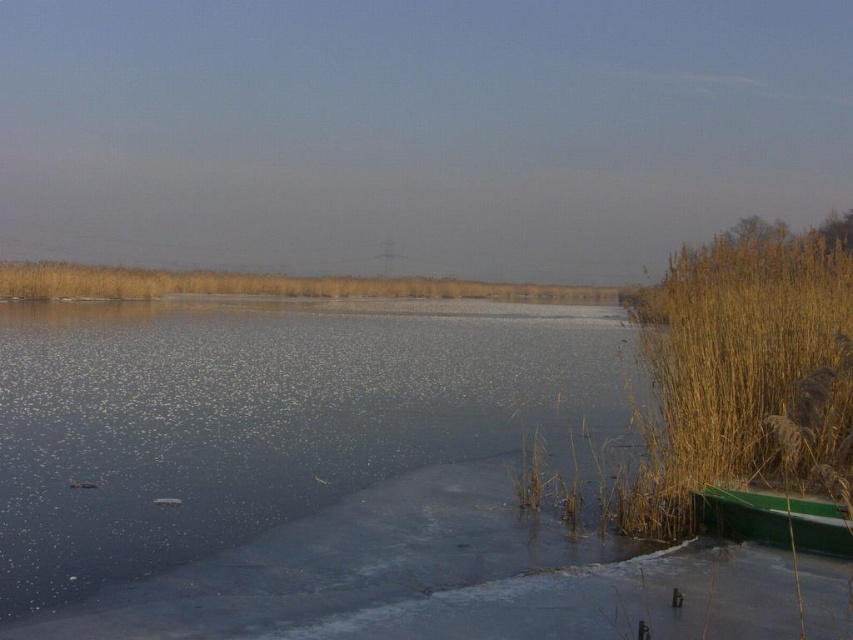
You are standing on the frozen lake and see the translucent ice at center and the green plastic canoe at lower right. Which object is closer to the water surface?

The translucent ice at center is located above the green plastic canoe at lower right, so the translucent ice at center is closer to the water surface.

From the picture: You are standing at the origin point in the winter landscape image. Where is the translucent ice at center located in terms of coordinates?

The translucent ice at center is located at coordinates point (260, 419).